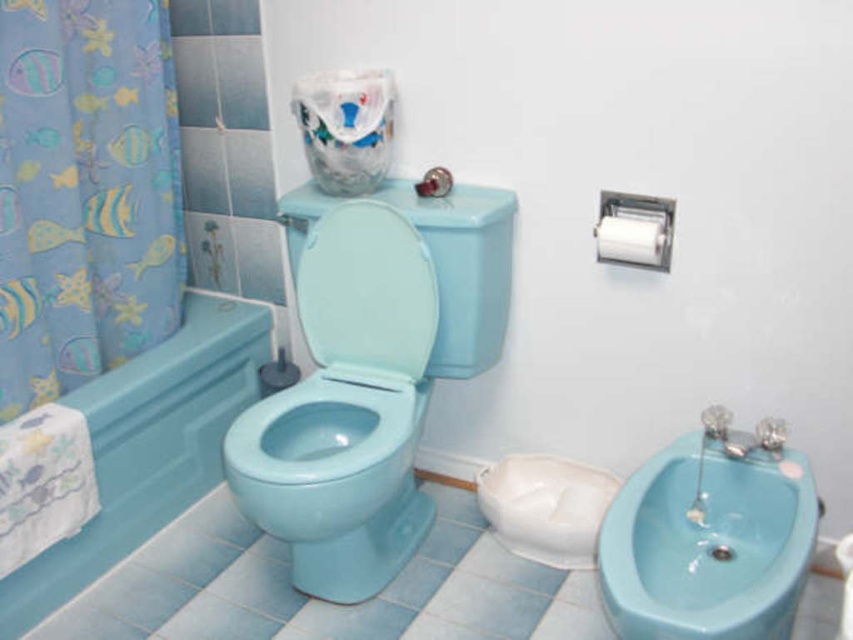
How much distance is there between matte blue bidet at lower right and matte blue bidet at center?

matte blue bidet at lower right and matte blue bidet at center are 24.09 inches apart.

Does point (625, 515) lie behind point (410, 509)?

No, (625, 515) is closer to viewer.

The width and height of the screenshot is (853, 640). I want to click on matte blue bidet at lower right, so click(x=711, y=536).

Does fish-patterned fabric at left appear on the right side of matte ceramic bathtub at lower left?

No, fish-patterned fabric at left is not to the right of matte ceramic bathtub at lower left.

Is point (140, 19) closer to viewer compared to point (149, 486)?

Yes, point (140, 19) is in front of point (149, 486).

Is point (148, 257) farther from viewer compared to point (183, 480)?

No, (148, 257) is in front of (183, 480).

Find the location of a particular element. The height and width of the screenshot is (640, 853). fish-patterned fabric at left is located at coordinates (85, 192).

You are a GUI agent. You are given a task and a screenshot of the screen. Output one action in this format:
    pyautogui.click(x=<x>, y=<y>)
    Task: Click on the matte ceramic bathtub at lower left
    This screenshot has width=853, height=640.
    Given the screenshot: What is the action you would take?
    pyautogui.click(x=148, y=445)

Can you confirm if matte ceramic bathtub at lower left is smaller than matte blue bidet at center?

Incorrect, matte ceramic bathtub at lower left is not smaller in size than matte blue bidet at center.

You are a GUI agent. You are given a task and a screenshot of the screen. Output one action in this format:
    pyautogui.click(x=<x>, y=<y>)
    Task: Click on the matte ceramic bathtub at lower left
    The height and width of the screenshot is (640, 853).
    Given the screenshot: What is the action you would take?
    pyautogui.click(x=148, y=445)